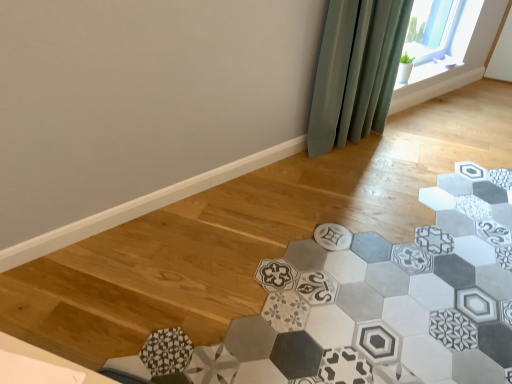
Find the location of a particular element. Image resolution: width=512 pixels, height=384 pixels. free space above patterned ceramic tile at center (from a real-world perspective) is located at coordinates (351, 271).